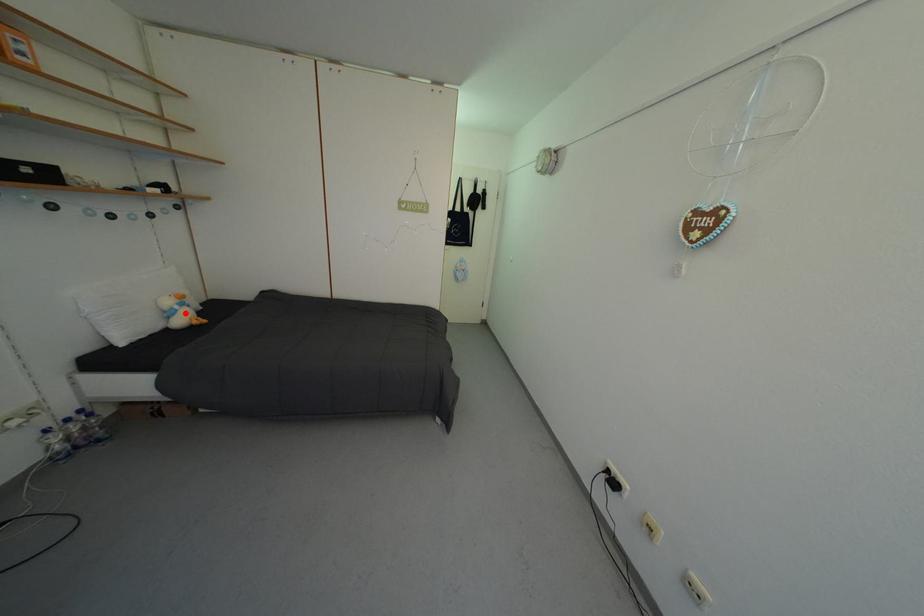
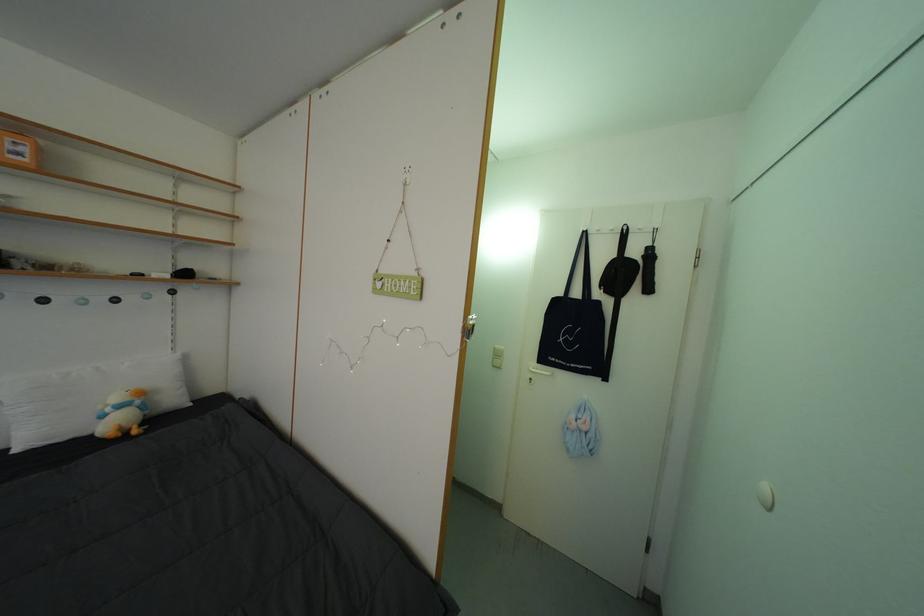
Find the pixel in the second image that matches the highlighted location in the first image.

(117, 415)